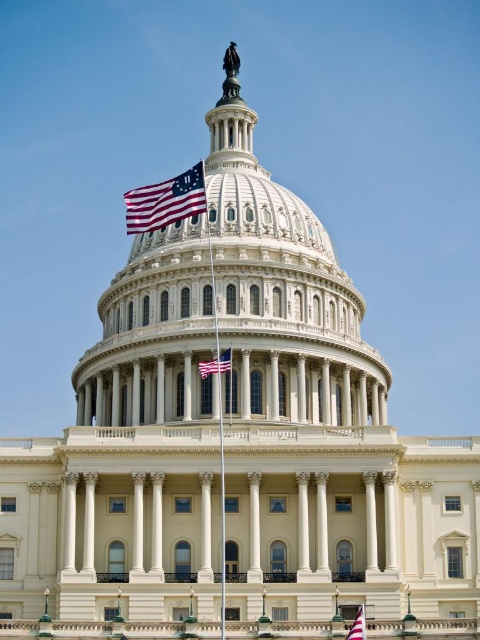
You are a photographer planning to capture the United States Capitol building with its iconic dome and the flagpole with the flag. Given that the polished metal flag pole at center is taller than the red fabric flag at lower right, how would you position your camera to ensure both the Capitol dome and the flag are in the frame without one blocking the other?

Position the camera so that the polished metal flag pole at center is placed to the side of the frame, allowing the taller flagpole to stand alongside the United States Capitol dome without obstructing it. Since the polished metal flag pole at center is taller than the red fabric flag at lower right, angling the camera slightly upward can include both the dome and the flag while maintaining their visibility.

You are standing in front of the United States Capitol building and want to take a photo. You notice two points marked on your map at coordinates point [200,192] and point [213,280]. Which of these points is closer to you?

Point [200,192] is closer to the viewer than point [213,280], so the point [200,192] is closer to you.

You are standing in front of the United States Capitol building and want to take a photo. There are two points marked on your map at coordinates point (216, 353) and point (360, 605). Which point should you choose to ensure that the Statue of Freedom on top of the Capitol dome is fully visible without any obstruction?

You should choose point (360, 605) because point (216, 353) is behind it, which might block the view of the Statue of Freedom on top of the Capitol dome.